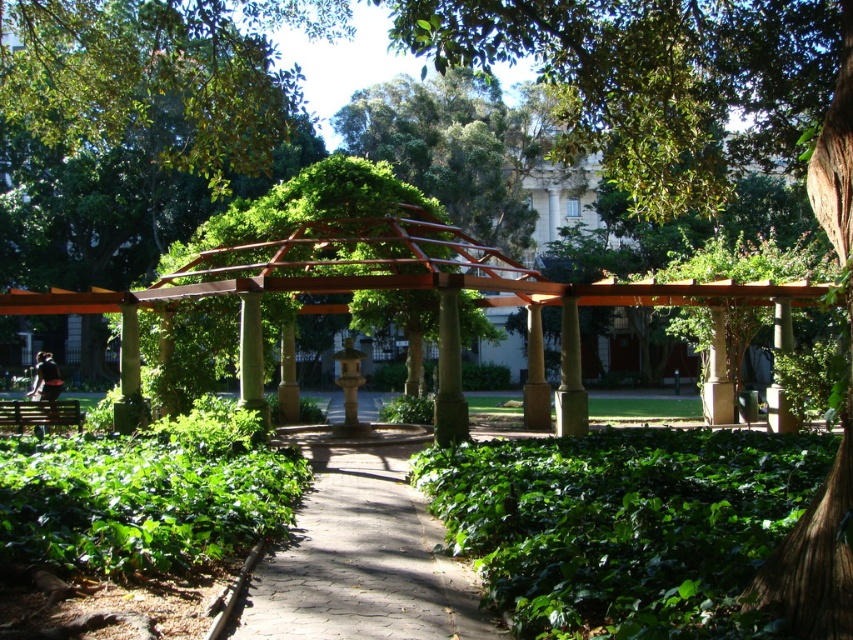
Question: Which of the following is the closest to the observer?

Choices:
 (A) (410, 496)
 (B) (704, 493)
 (C) (773, 81)
 (D) (450, 292)

Answer: (B)

Question: From the image, what is the correct spatial relationship of green leafy bush at center in relation to brown cobblestone path at center?

Choices:
 (A) below
 (B) above

Answer: (B)

Question: Which object appears closest to the camera in this image?

Choices:
 (A) green leafy tree at center
 (B) brown wood column at center
 (C) green leafy bush at center

Answer: (A)

Question: Considering the relative positions of brown cobblestone path at center and brown wood column at center in the image provided, where is brown cobblestone path at center located with respect to brown wood column at center?

Choices:
 (A) left
 (B) right

Answer: (A)

Question: Which of the following is the closest to the observer?

Choices:
 (A) brown cobblestone path at center
 (B) green leafy tree at center
 (C) brown wood column at center
 (D) green leafy bush at center

Answer: (B)

Question: Considering the relative positions of green leafy tree at center and green leafy bush at center in the image provided, where is green leafy tree at center located with respect to green leafy bush at center?

Choices:
 (A) below
 (B) above

Answer: (B)